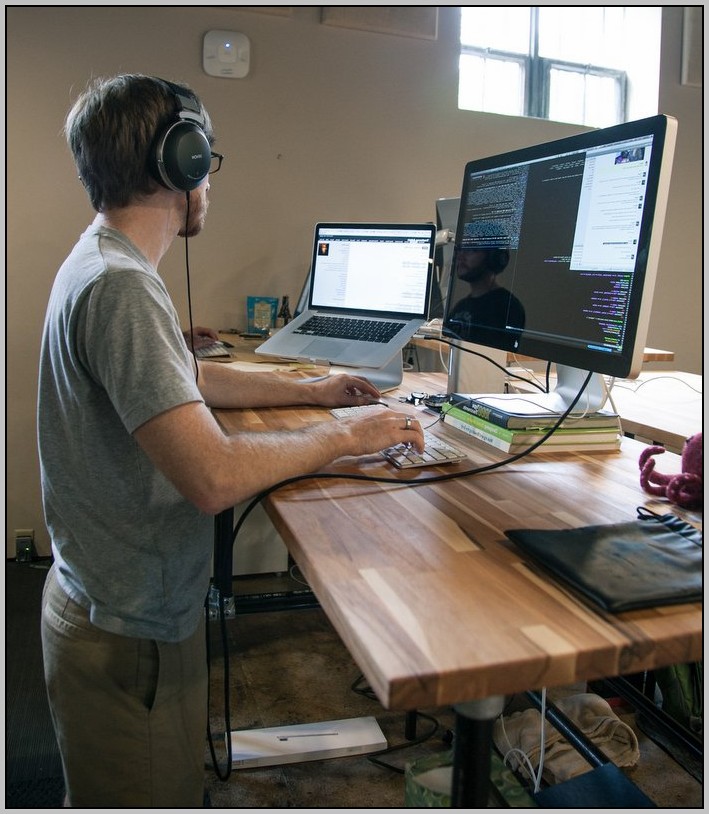
Image resolution: width=709 pixels, height=814 pixels. Find the location of `mac monitor`. mac monitor is located at coordinates (535, 259).